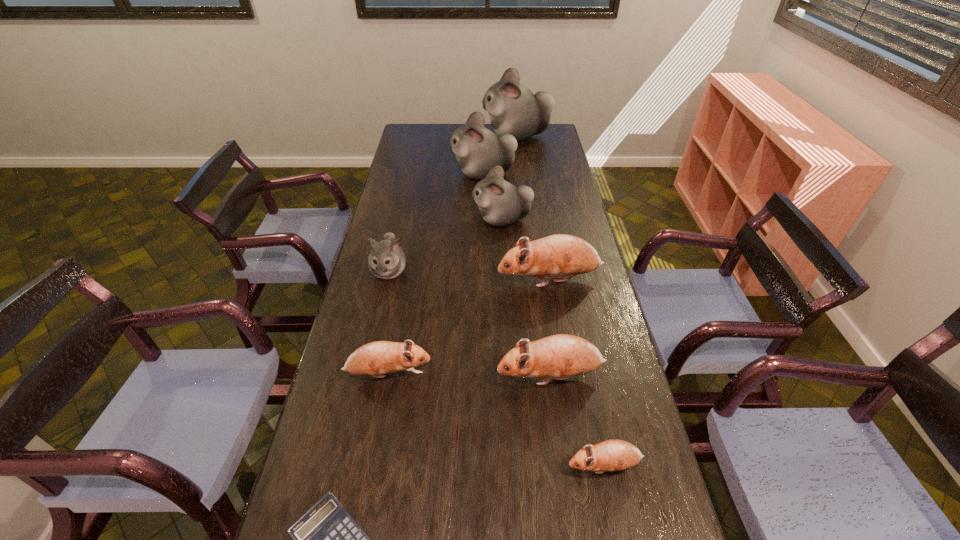
This screenshot has width=960, height=540. What are the coordinates of `vacant point located at the face of the second smallest brown hamster` in the screenshot? It's located at (520, 374).

This screenshot has height=540, width=960. I want to click on vacant space situated at the face of the second nearest object, so click(477, 466).

Locate an element on the screen. vacant area situated at the face of the second nearest object is located at coordinates (473, 466).

This screenshot has height=540, width=960. What are the coordinates of `vacant space situated 0.270m at the face of the second nearest object` in the screenshot? It's located at (452, 466).

This screenshot has width=960, height=540. Identify the location of object that is at the far edge. (513, 109).

Image resolution: width=960 pixels, height=540 pixels. I want to click on object that is positioned at the far right corner, so click(513, 109).

This screenshot has width=960, height=540. In order to click on vacant region at the far edge in this screenshot , I will do `click(437, 141)`.

Where is `free space at the left edge of the desktop`? The image size is (960, 540). free space at the left edge of the desktop is located at coordinates (369, 296).

Find the location of a particular element. The image size is (960, 540). free space at the right edge of the desktop is located at coordinates (541, 187).

Find the location of a particular element. The width and height of the screenshot is (960, 540). vacant space that is in between the second nearest white hamster and the farthest hamster is located at coordinates (509, 178).